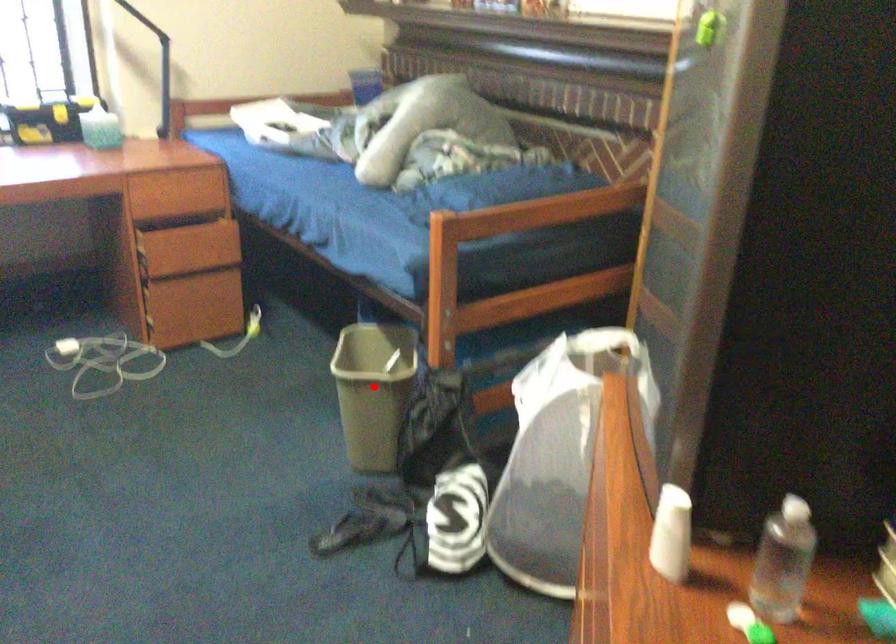
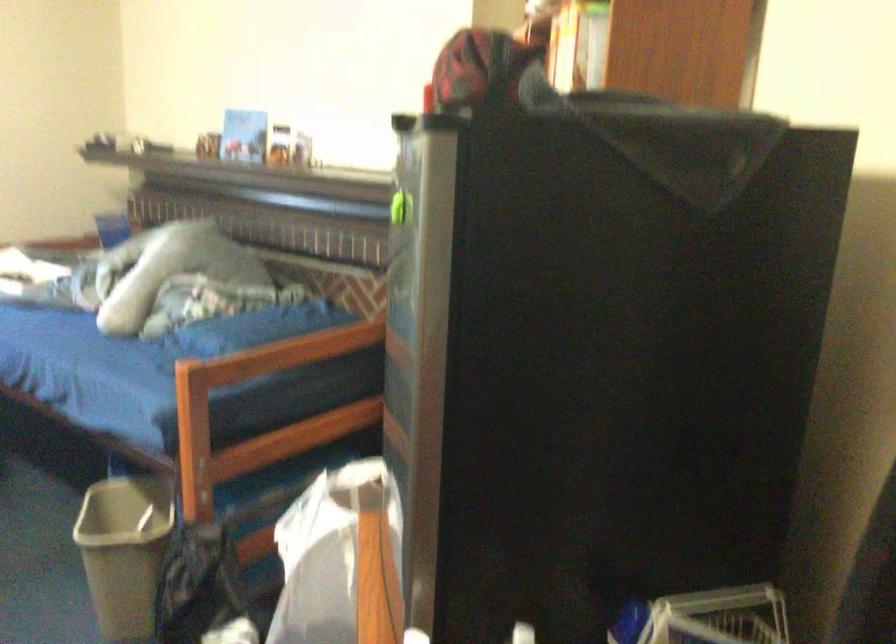
Question: I am providing you with two images of the same scene from different viewpoints. In image1, a red point is highlighted. Considering the same 3D point in image2, which of the following is correct?

Choices:
 (A) It is closer
 (B) It is farther

Answer: (A)